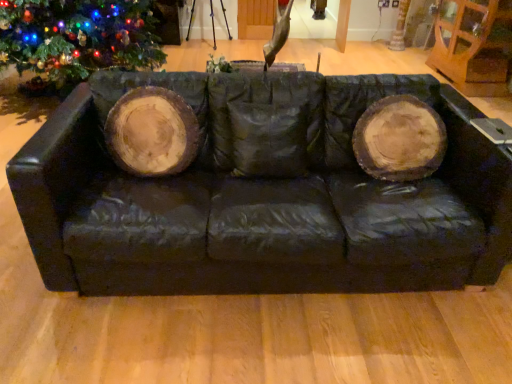
Question: Is the depth of brown wood tree trunk at upper right greater than that of black leather couch at center?

Choices:
 (A) no
 (B) yes

Answer: (B)

Question: Are brown wood tree trunk at upper right and black leather couch at center far apart?

Choices:
 (A) yes
 (B) no

Answer: (A)

Question: Is brown wood tree trunk at upper right oriented towards black leather couch at center?

Choices:
 (A) yes
 (B) no

Answer: (B)

Question: Can you confirm if brown wood tree trunk at upper right is smaller than black leather couch at center?

Choices:
 (A) no
 (B) yes

Answer: (B)

Question: Is brown wood tree trunk at upper right turned away from black leather couch at center?

Choices:
 (A) yes
 (B) no

Answer: (B)

Question: Considering the positions of point (399, 26) and point (289, 231), is point (399, 26) closer or farther from the camera than point (289, 231)?

Choices:
 (A) closer
 (B) farther

Answer: (B)

Question: From their relative heights in the image, would you say brown wood tree trunk at upper right is taller or shorter than black leather couch at center?

Choices:
 (A) tall
 (B) short

Answer: (B)

Question: From a real-world perspective, is brown wood tree trunk at upper right physically located above or below black leather couch at center?

Choices:
 (A) above
 (B) below

Answer: (B)

Question: Is brown wood tree trunk at upper right wider or thinner than black leather couch at center?

Choices:
 (A) wide
 (B) thin

Answer: (B)

Question: From a real-world perspective, is green matte christmas tree at left above or below black leather couch at center?

Choices:
 (A) below
 (B) above

Answer: (B)

Question: Considering the positions of point 41,69 and point 238,240, is point 41,69 closer or farther from the camera than point 238,240?

Choices:
 (A) farther
 (B) closer

Answer: (A)

Question: Considering the positions of green matte christmas tree at left and black leather couch at center in the image, is green matte christmas tree at left wider or thinner than black leather couch at center?

Choices:
 (A) thin
 (B) wide

Answer: (B)

Question: Is green matte christmas tree at left inside the boundaries of black leather couch at center, or outside?

Choices:
 (A) outside
 (B) inside

Answer: (A)

Question: Visually, is black leather couch at center positioned to the left or to the right of brown wood tree trunk at upper right?

Choices:
 (A) left
 (B) right

Answer: (A)

Question: In the image, is black leather couch at center positioned in front of or behind brown wood tree trunk at upper right?

Choices:
 (A) front
 (B) behind

Answer: (A)